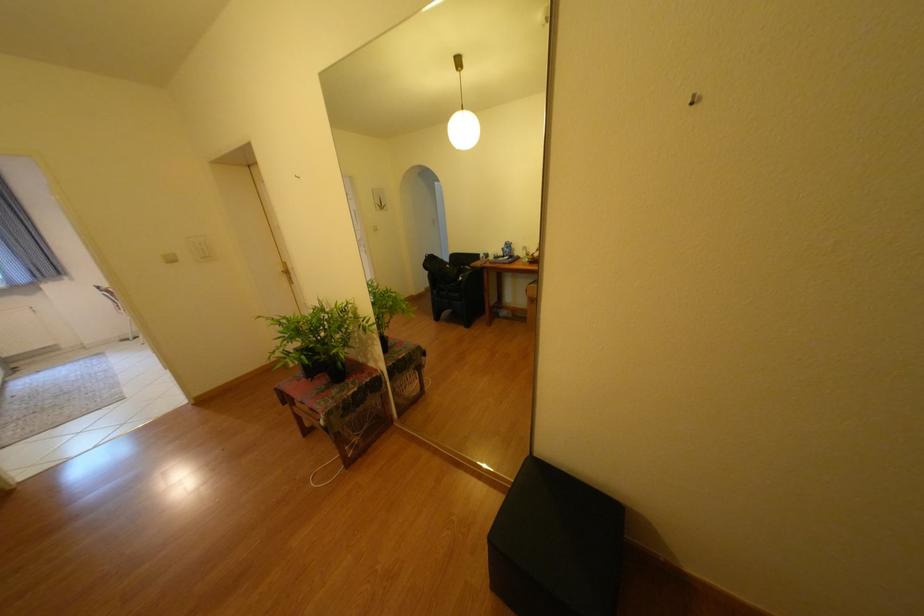
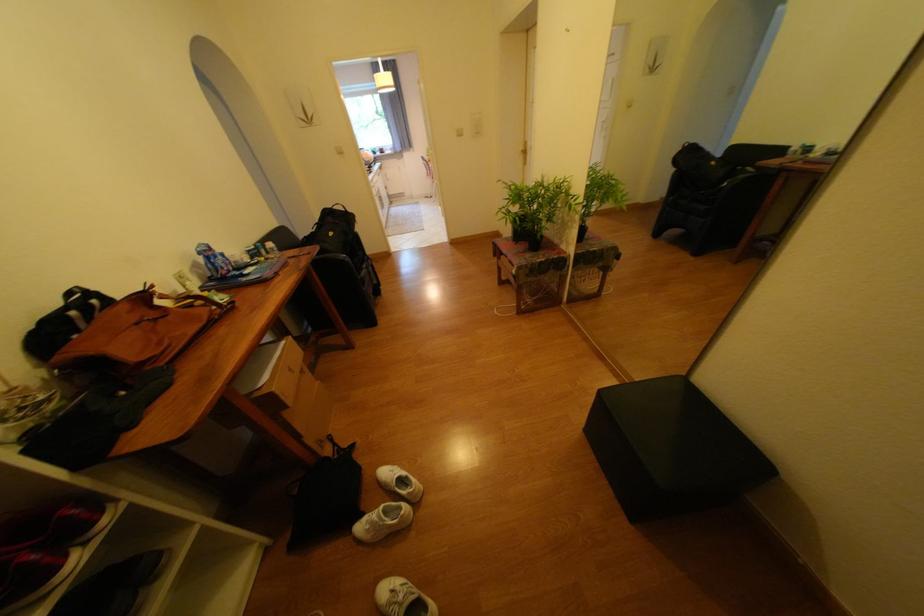
How did the camera likely rotate?

The camera's rotation is toward left-down.